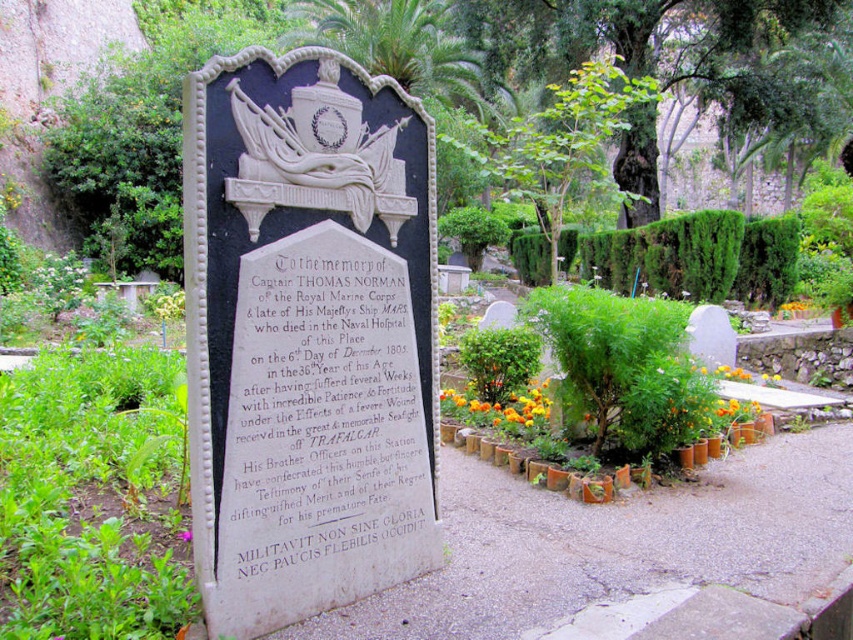
Question: Does white marble gravestone at center appear on the right side of orange fabric flower at center?

Choices:
 (A) yes
 (B) no

Answer: (B)

Question: Does orange fabric flower at center have a lesser width compared to orange matte flower at center?

Choices:
 (A) no
 (B) yes

Answer: (B)

Question: Does black stone plaque at center appear on the left side of orange petal at center?

Choices:
 (A) no
 (B) yes

Answer: (A)

Question: Which point is farther from the camera taking this photo?

Choices:
 (A) (239, 513)
 (B) (476, 426)
 (C) (180, 531)
 (D) (300, 616)

Answer: (B)

Question: Which point is closer to the camera?

Choices:
 (A) (798, 307)
 (B) (439, 538)
 (C) (498, 419)

Answer: (B)

Question: Based on their relative distances, which object is nearer to the orange petal at center?

Choices:
 (A) orange matte flower at center
 (B) orange fabric flower at center
 (C) black stone plaque at center

Answer: (C)